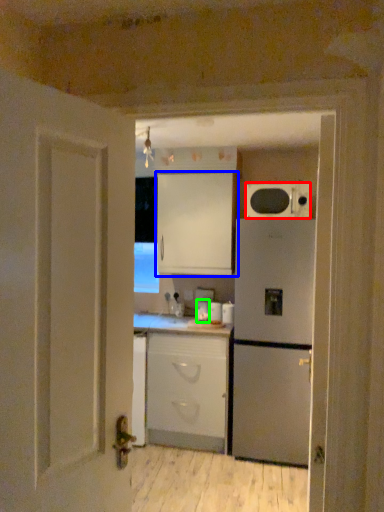
Question: Which object is positioned farthest from microwave oven (highlighted by a red box)? Select from cabinetry (highlighted by a blue box) and appliance (highlighted by a green box).

Choices:
 (A) cabinetry
 (B) appliance

Answer: (B)